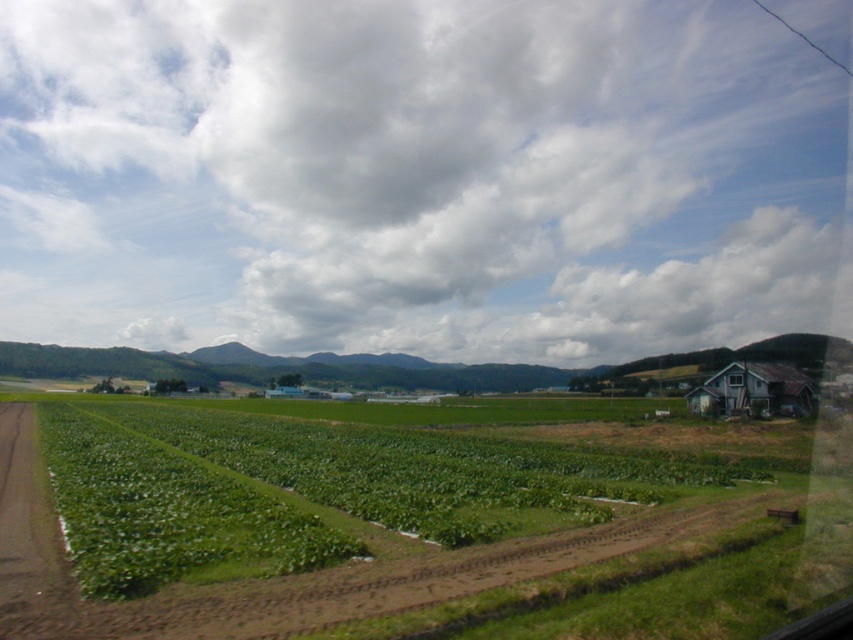
You are standing at the edge of the green leafy field at center and want to reach the rusty wood house at right. According to the scene, which direction should you head towards to get there?

The green leafy field at center is located below the rusty wood house at right, so you should head upwards to reach the rusty wood house at right from the field.

You are a farmer planning to plant a new crop in the green leafy field at center and the rusty wood house at right. Since you want to maximize your planting area, which location should you choose and why?

The green leafy field at center is larger in size than the rusty wood house at right, so you should choose the green leafy field at center to maximize your planting area.